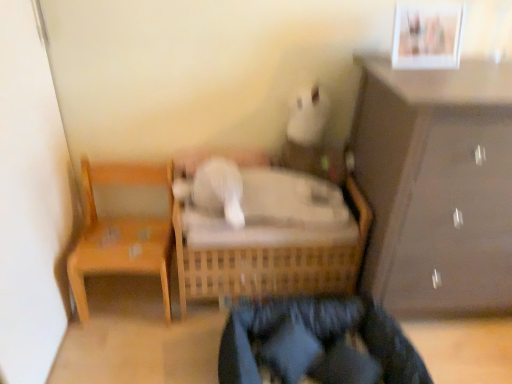
Measure the distance between point (426, 175) and camera.

Point (426, 175) is 4.17 feet away from camera.

What do you see at coordinates (122, 233) in the screenshot? Image resolution: width=512 pixels, height=384 pixels. I see `wooden chair at left` at bounding box center [122, 233].

In order to face woven wood crib at center, should I rotate leftwards or rightwards?

It's best to rotate right around 1.070 degrees.

This screenshot has height=384, width=512. I want to click on white glossy picture frame at upper right, so click(426, 37).

From a real-world perspective, which is physically below, matte brown cabinet at right or woven wood crib at center?

From a 3D spatial view, woven wood crib at center is below.

Where is `cabinetry lying on the right of woven wood crib at center`? cabinetry lying on the right of woven wood crib at center is located at coordinates [436, 186].

Between matte brown cabinet at right and woven wood crib at center, which one appears on the right side from the viewer's perspective?

Positioned to the right is matte brown cabinet at right.

Based on the photo, measure the distance between matte brown cabinet at right and woven wood crib at center.

matte brown cabinet at right is 13.65 inches away from woven wood crib at center.

Considering the sizes of objects dark blue fabric pants at lower center and wooden chair at left in the image provided, who is shorter, dark blue fabric pants at lower center or wooden chair at left?

With less height is dark blue fabric pants at lower center.

In terms of size, does dark blue fabric pants at lower center appear bigger or smaller than wooden chair at left?

Clearly, dark blue fabric pants at lower center is smaller in size than wooden chair at left.

Does dark blue fabric pants at lower center lie behind wooden chair at left?

No, dark blue fabric pants at lower center is in front of wooden chair at left.

Is dark blue fabric pants at lower center at the left side of wooden chair at left?

→ No.

Is woven wood crib at center outside of matte brown cabinet at right?

woven wood crib at center is positioned outside matte brown cabinet at right.

Measure the distance from woven wood crib at center to matte brown cabinet at right.

woven wood crib at center is 13.65 inches from matte brown cabinet at right.

Is woven wood crib at center oriented towards matte brown cabinet at right?

No, woven wood crib at center does not turn towards matte brown cabinet at right.

Which of these two, woven wood crib at center or matte brown cabinet at right, stands taller?

With more height is matte brown cabinet at right.

Is woven wood crib at center completely or partially outside of white glossy picture frame at upper right?

Indeed, woven wood crib at center is completely outside white glossy picture frame at upper right.

Is woven wood crib at center oriented away from white glossy picture frame at upper right?

woven wood crib at center is not turned away from white glossy picture frame at upper right.

Considering the points (341, 265) and (419, 63), which point is behind, point (341, 265) or point (419, 63)?

Positioned behind is point (341, 265).

From a real-world perspective, is dark blue fabric pants at lower center physically located above or below white glossy picture frame at upper right?

In terms of real-world spatial position, dark blue fabric pants at lower center is below white glossy picture frame at upper right.

Is dark blue fabric pants at lower center far away from white glossy picture frame at upper right?

dark blue fabric pants at lower center is near white glossy picture frame at upper right, not far away.

Considering the relative sizes of dark blue fabric pants at lower center and white glossy picture frame at upper right in the image provided, is dark blue fabric pants at lower center shorter than white glossy picture frame at upper right?

Yes, dark blue fabric pants at lower center is shorter than white glossy picture frame at upper right.

From the image's perspective, relative to white glossy picture frame at upper right, is dark blue fabric pants at lower center above or below?

dark blue fabric pants at lower center is situated lower than white glossy picture frame at upper right in the image.

Looking at this image, which object is positioned more to the left, woven wood crib at center or wooden chair at left?

wooden chair at left is more to the left.

Looking at this image, from a real-world perspective, is woven wood crib at center above or below wooden chair at left?

woven wood crib at center is situated lower than wooden chair at left in the real world.

What's the angular difference between woven wood crib at center and wooden chair at left's facing directions?

2.45 degrees.

Can woven wood crib at center be found inside dark blue fabric pants at lower center?

No, dark blue fabric pants at lower center does not contain woven wood crib at center.

What's the angular difference between dark blue fabric pants at lower center and woven wood crib at center's facing directions?

dark blue fabric pants at lower center and woven wood crib at center are facing 4.27 degrees away from each other.

Can you confirm if dark blue fabric pants at lower center is smaller than woven wood crib at center?

Yes.

Locate an element on the screen. This screenshot has width=512, height=384. cabinetry above the woven wood crib at center (from the image's perspective) is located at coordinates (436, 186).

This screenshot has width=512, height=384. I want to click on chair on the left side of dark blue fabric pants at lower center, so click(x=122, y=233).

Based on their spatial positions, is matte brown cabinet at right or white glossy picture frame at upper right further from dark blue fabric pants at lower center?

The object further to dark blue fabric pants at lower center is white glossy picture frame at upper right.

Considering their positions, is dark blue fabric pants at lower center positioned closer to woven wood crib at center than matte brown cabinet at right?

Among the two, dark blue fabric pants at lower center is located nearer to woven wood crib at center.

Considering their positions, is matte brown cabinet at right positioned closer to woven wood crib at center than wooden chair at left?

wooden chair at left lies closer to woven wood crib at center than the other object.

Consider the image. Considering their positions, is white glossy picture frame at upper right positioned closer to dark blue fabric pants at lower center than wooden chair at left?

wooden chair at left lies closer to dark blue fabric pants at lower center than the other object.

Based on their spatial positions, is woven wood crib at center or white glossy picture frame at upper right further from dark blue fabric pants at lower center?

white glossy picture frame at upper right is positioned further to the anchor dark blue fabric pants at lower center.

When comparing their distances from white glossy picture frame at upper right, does wooden chair at left or matte brown cabinet at right seem closer?

matte brown cabinet at right lies closer to white glossy picture frame at upper right than the other object.

Consider the image. When comparing their distances from white glossy picture frame at upper right, does matte brown cabinet at right or woven wood crib at center seem further?

Based on the image, woven wood crib at center appears to be further to white glossy picture frame at upper right.

Based on their spatial positions, is dark blue fabric pants at lower center or white glossy picture frame at upper right further from wooden chair at left?

The object further to wooden chair at left is white glossy picture frame at upper right.

Find the location of a particular element. Image resolution: width=512 pixels, height=384 pixels. chair between white glossy picture frame at upper right and dark blue fabric pants at lower center from top to bottom is located at coordinates (122, 233).

Locate an element on the screen. furniture between wooden chair at left and matte brown cabinet at right from left to right is located at coordinates (275, 258).

Find the location of a particular element. Image resolution: width=512 pixels, height=384 pixels. clothing between wooden chair at left and matte brown cabinet at right from left to right is located at coordinates (317, 344).

What are the coordinates of `picture frame between wooden chair at left and matte brown cabinet at right from left to right` in the screenshot? It's located at (426, 37).